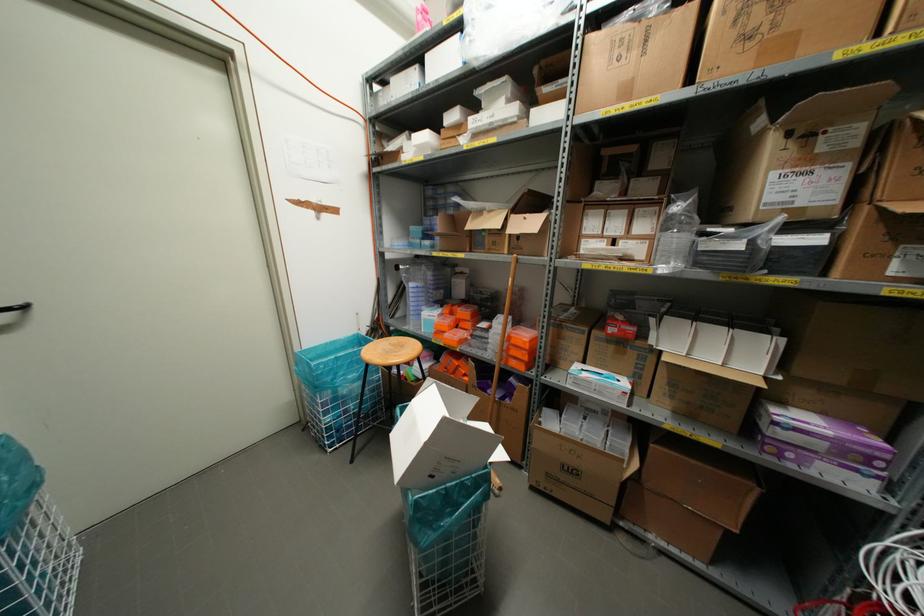
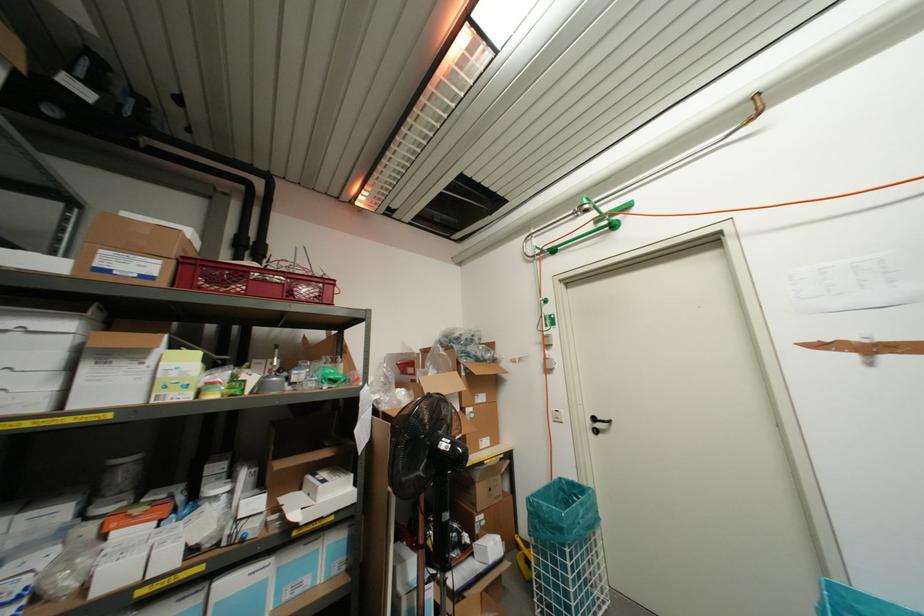
Question: The images are taken continuously from a first-person perspective. In which direction is your viewpoint rotating?

Choices:
 (A) Left
 (B) Right
 (C) Up
 (D) Down

Answer: (A)